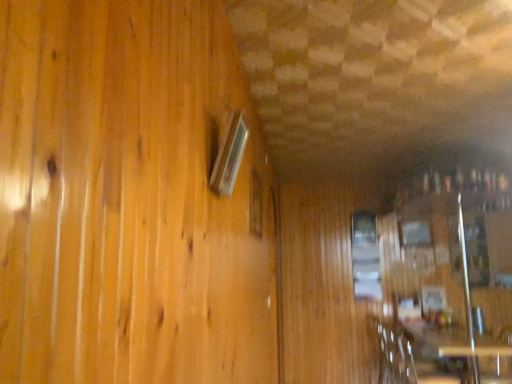
Question: Is matte glass window at upper left, which is counted as the third window, starting from the back, positioned far away from clear glass window at center, which is counted as the first window, starting from the bottom?

Choices:
 (A) no
 (B) yes

Answer: (B)

Question: Is matte glass window at upper left, arranged as the first window when viewed from the top, further to camera compared to clear glass window at center, arranged as the 1th window when viewed from the back?

Choices:
 (A) yes
 (B) no

Answer: (B)

Question: Are matte glass window at upper left, which is the third window from bottom to top, and clear glass window at center, which is counted as the first window, starting from the bottom, making contact?

Choices:
 (A) yes
 (B) no

Answer: (B)

Question: Could you tell me if matte glass window at upper left, which is counted as the first window, starting from the front, is facing clear glass window at center, which ranks as the third window in front-to-back order?

Choices:
 (A) yes
 (B) no

Answer: (B)

Question: Does matte glass window at upper left, positioned as the third window in right-to-left order, have a smaller size compared to clear glass window at center, which ranks as the third window in front-to-back order?

Choices:
 (A) no
 (B) yes

Answer: (A)

Question: From the image's perspective, would you say matte glass window at upper left, arranged as the first window when viewed from the top, is shown under clear glass window at center, arranged as the 1th window when viewed from the back?

Choices:
 (A) no
 (B) yes

Answer: (A)

Question: From the image's perspective, does clear glass window at center, which is the first window from right to left, appear higher than wooden table at lower right, marked as the second table in a back-to-front arrangement?

Choices:
 (A) no
 (B) yes

Answer: (B)

Question: Does clear glass window at center, arranged as the 1th window when viewed from the back, come behind wooden table at lower right, marked as the second table in a back-to-front arrangement?

Choices:
 (A) yes
 (B) no

Answer: (A)

Question: Is clear glass window at center, which ranks as the third window in front-to-back order, not within wooden table at lower right, which is the first table in front-to-back order?

Choices:
 (A) yes
 (B) no

Answer: (A)

Question: Is wooden table at lower right, which is the first table in front-to-back order, completely or partially inside clear glass window at center, which ranks as the third window in front-to-back order?

Choices:
 (A) no
 (B) yes

Answer: (A)

Question: Is clear glass window at center, which appears as the third window when viewed from the top, closer to camera compared to wooden table at lower right, which is the first table in front-to-back order?

Choices:
 (A) yes
 (B) no

Answer: (B)

Question: Is clear glass window at center, which appears as the third window when viewed from the top, smaller than wooden table at lower right, which is the first table in front-to-back order?

Choices:
 (A) no
 (B) yes

Answer: (B)

Question: Can you confirm if wooden armchair at lower right is taller than transparent glass table at lower right, marked as the first table in a back-to-front arrangement?

Choices:
 (A) no
 (B) yes

Answer: (B)